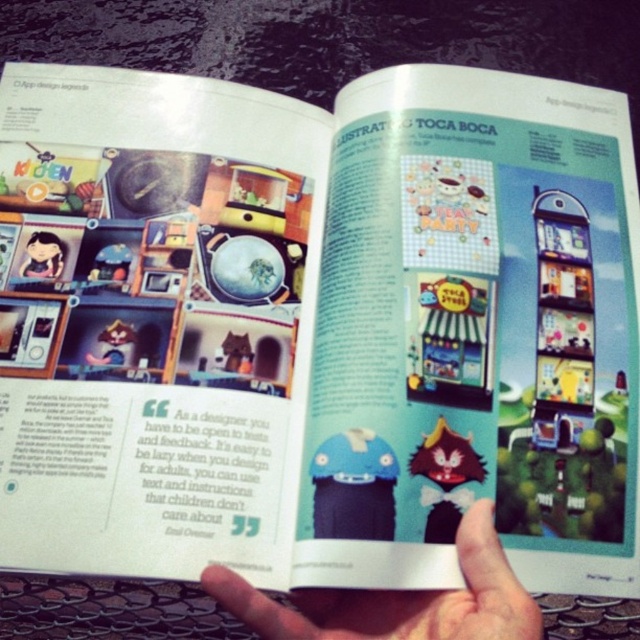
You are a user trying to interact with the matte black doll at upper left on an open magazine spread. There is a smooth skin hand at center in the way. Can you reach the doll without moving the hand?

The smooth skin hand at center is in front of the matte black doll at upper left, so you cannot reach the doll without moving the hand.

You are looking at the magazine spread and notice the smooth skin hand at center and the matte black doll at upper left. Which object is positioned to the right of the other?

The smooth skin hand at center is to the right of matte black doll at upper left.